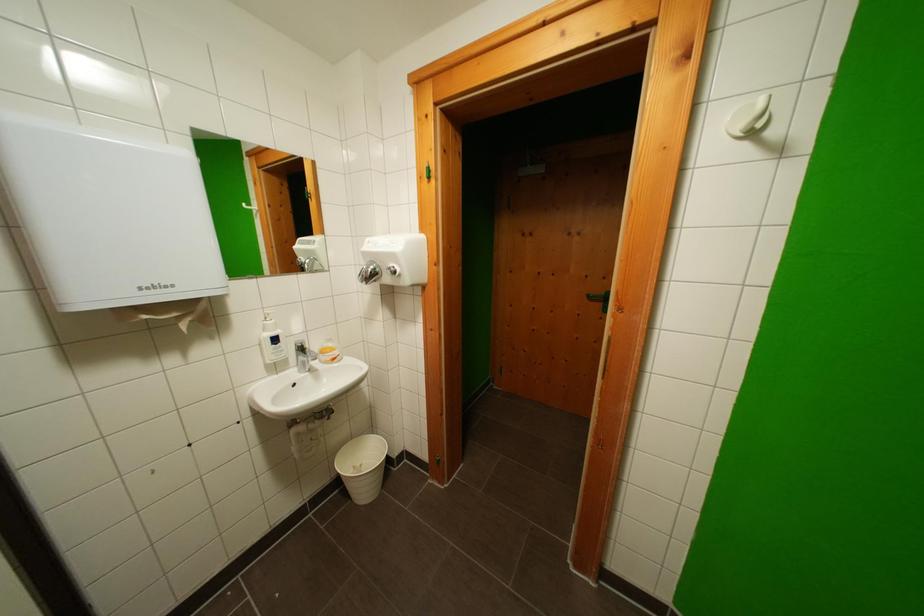
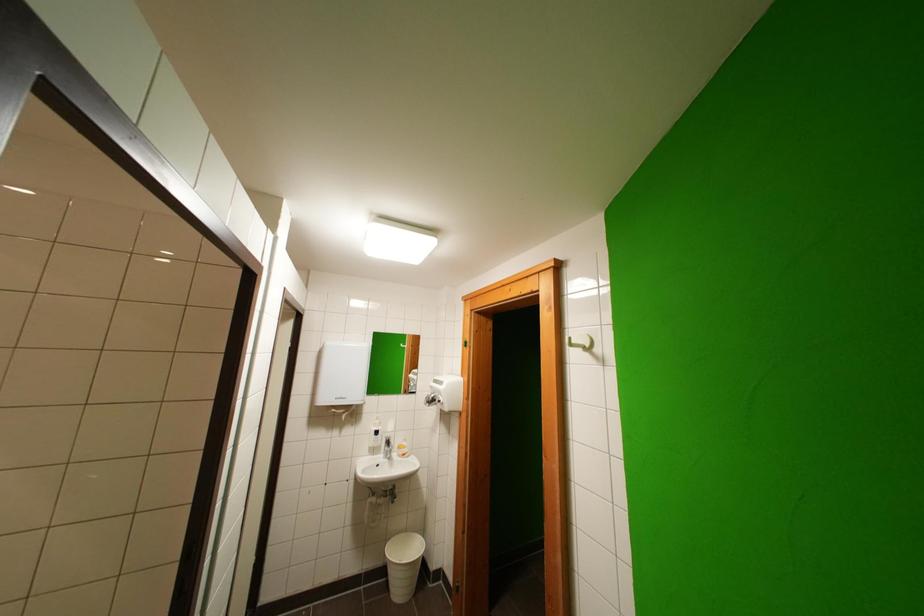
Where in the second image is the point corresponding to the point at 371,496 from the first image?

(406, 593)